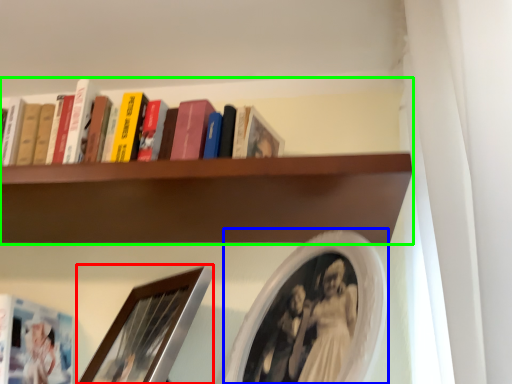
Question: Which is nearer to the picture frame (highlighted by a red box)? picture frame (highlighted by a blue box) or shelf (highlighted by a green box).

Choices:
 (A) picture frame
 (B) shelf

Answer: (A)